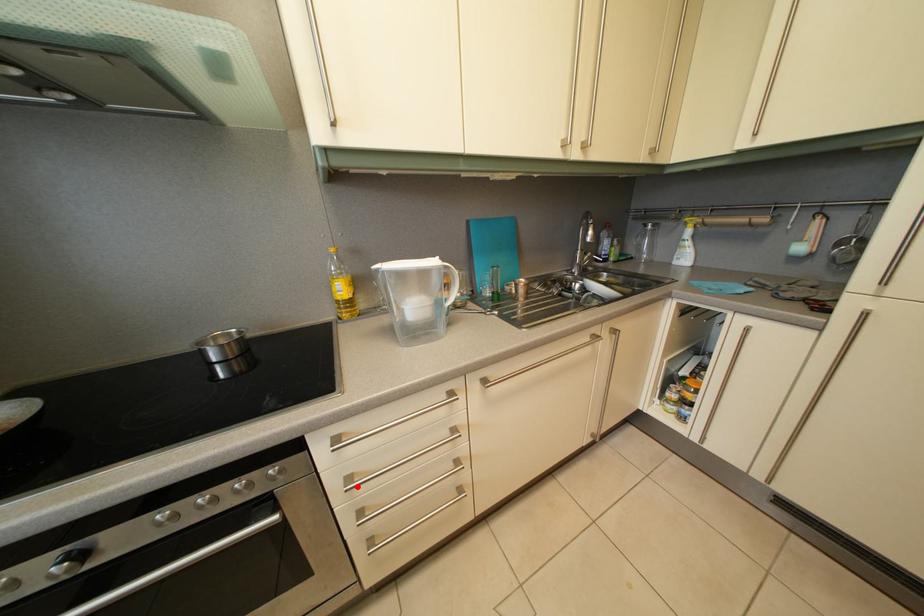
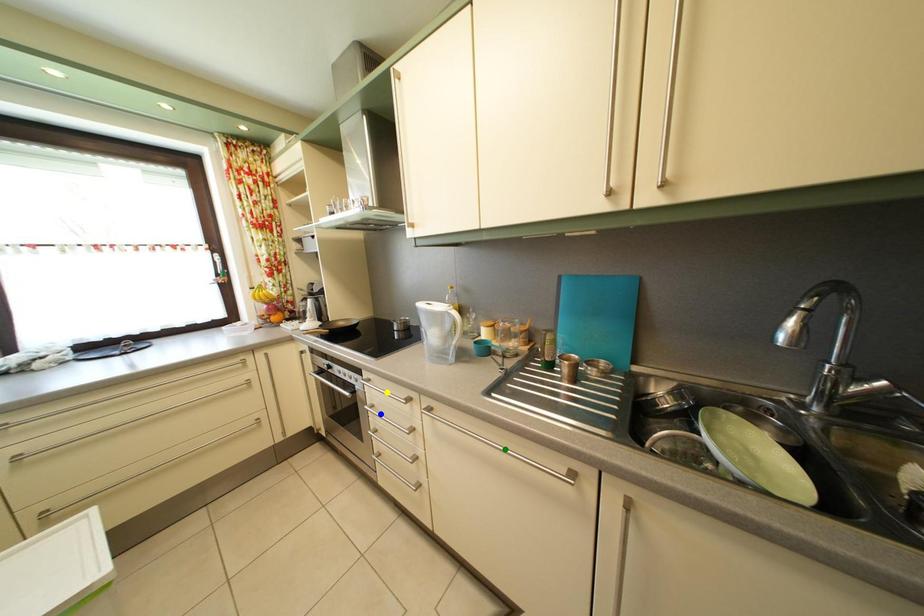
Question: I am providing you with two images of the same scene from different viewpoints. A red point is marked on the first image. You are given multiple points on the second image. Which spot in image 2 lines up with the point in image 1?

Choices:
 (A) green point
 (B) yellow point
 (C) blue point

Answer: (C)